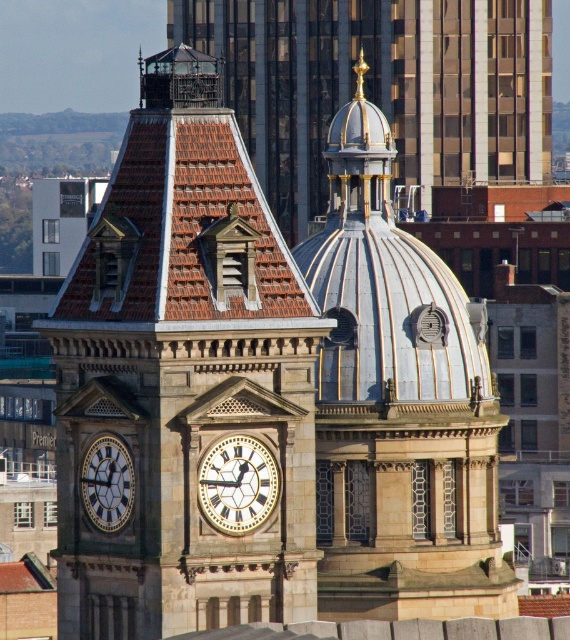
Can you confirm if brown stone clock tower at center is bigger than polished silver dome at center?

Yes, brown stone clock tower at center is bigger than polished silver dome at center.

Between point (253, 552) and point (321, 476), which one is positioned in front?

Point (253, 552) is more forward.

You are a GUI agent. You are given a task and a screenshot of the screen. Output one action in this format:
    pyautogui.click(x=<x>, y=<y>)
    Task: Click on the brown stone clock tower at center
    This screenshot has height=640, width=570.
    Given the screenshot: What is the action you would take?
    pyautogui.click(x=184, y=376)

Who is lower down, brown stone clock tower at center or white marble clock at center?

white marble clock at center is lower down.

Based on the photo, does brown stone clock tower at center have a larger size compared to white marble clock at center?

Indeed, brown stone clock tower at center has a larger size compared to white marble clock at center.

Is point (63, 285) closer to camera compared to point (262, 502)?

No, (63, 285) is further to viewer.

The image size is (570, 640). What are the coordinates of `brown stone clock tower at center` in the screenshot? It's located at (184, 376).

Image resolution: width=570 pixels, height=640 pixels. What do you see at coordinates (184, 376) in the screenshot? I see `brown stone clock tower at center` at bounding box center [184, 376].

Is brown stone clock tower at center above gold-toned metal clock at left?

Correct, brown stone clock tower at center is located above gold-toned metal clock at left.

This screenshot has width=570, height=640. I want to click on brown stone clock tower at center, so click(x=184, y=376).